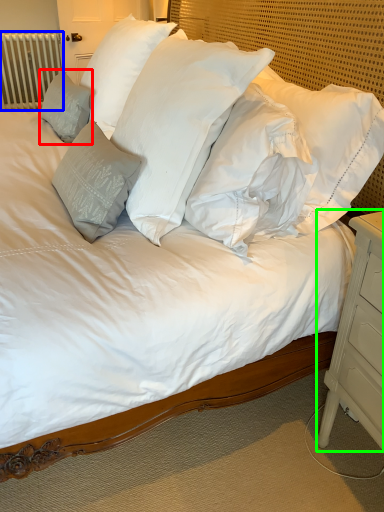
Question: Which object is positioned farthest from pillow (highlighted by a red box)? Select from radiator (highlighted by a blue box) and nightstand (highlighted by a green box).

Choices:
 (A) radiator
 (B) nightstand

Answer: (A)